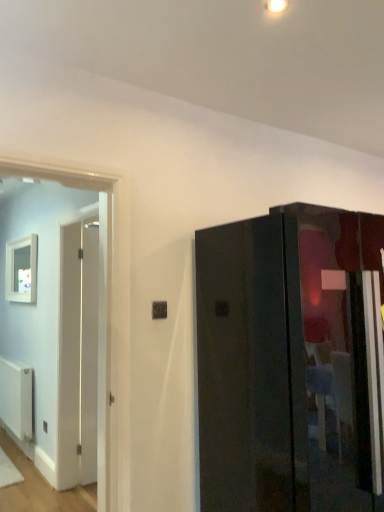
Find the location of a particular element. white matte picture frame at left is located at coordinates (21, 270).

I want to click on black plastic electric outlet at center, so click(x=159, y=310).

Describe the element at coordinates (291, 362) in the screenshot. I see `glossy black cabinet at right` at that location.

Locate an element on the screen. white matte picture frame at left is located at coordinates (21, 270).

From a real-world perspective, which is physically above, glossy black cabinet at right or white matte picture frame at left?

white matte picture frame at left.

Is white matte picture frame at left surrounded by glossy black cabinet at right?

That's incorrect, white matte picture frame at left is not inside glossy black cabinet at right.

Considering the relative sizes of glossy black cabinet at right and white matte picture frame at left in the image provided, is glossy black cabinet at right thinner than white matte picture frame at left?

In fact, glossy black cabinet at right might be wider than white matte picture frame at left.

Are glossy black cabinet at right and white matte picture frame at left beside each other?

No, glossy black cabinet at right is not making contact with white matte picture frame at left.

Are black plastic electric outlet at center and white matte radiator at lower left far apart?

Yes, black plastic electric outlet at center is far from white matte radiator at lower left.

Is point (160, 318) closer or farther from the camera than point (21, 369)?

Clearly, point (160, 318) is closer to the camera than point (21, 369).

Considering the sizes of objects black plastic electric outlet at center and white matte radiator at lower left in the image provided, who is smaller, black plastic electric outlet at center or white matte radiator at lower left?

Smaller between the two is black plastic electric outlet at center.

Can we say black plastic electric outlet at center lies outside white matte radiator at lower left?

Yes.

From the image's perspective, between glossy black cabinet at right and black plastic electric outlet at center, which one is located above?

From the image's view, black plastic electric outlet at center is above.

Can you tell me how much glossy black cabinet at right and black plastic electric outlet at center differ in facing direction?

0.858 degrees separate the facing orientations of glossy black cabinet at right and black plastic electric outlet at center.

Are glossy black cabinet at right and black plastic electric outlet at center making contact?

No, glossy black cabinet at right is not with black plastic electric outlet at center.

This screenshot has width=384, height=512. I want to click on door in front of the black plastic electric outlet at center, so [x=291, y=362].

Considering the positions of objects black plastic electric outlet at center and white matte picture frame at left in the image provided, who is more to the left, black plastic electric outlet at center or white matte picture frame at left?

white matte picture frame at left.

Where is `picture frame above the black plastic electric outlet at center (from the image's perspective)`? The width and height of the screenshot is (384, 512). picture frame above the black plastic electric outlet at center (from the image's perspective) is located at coordinates point(21,270).

From a real-world perspective, relative to white matte picture frame at left, is black plastic electric outlet at center vertically above or below?

Clearly, from a real-world perspective, black plastic electric outlet at center is below white matte picture frame at left.

Could white matte picture frame at left be considered to be inside black plastic electric outlet at center?

Actually, white matte picture frame at left is outside black plastic electric outlet at center.

Is white matte picture frame at left turned away from glossy black cabinet at right?

white matte picture frame at left is not turned away from glossy black cabinet at right.

Is white matte picture frame at left to the right of glossy black cabinet at right from the viewer's perspective?

No.

From the image's perspective, is white matte picture frame at left located above or below glossy black cabinet at right?

white matte picture frame at left is situated higher than glossy black cabinet at right in the image.

From a real-world perspective, who is located higher, glossy black cabinet at right or white matte radiator at lower left?

glossy black cabinet at right is physically above.

Considering the sizes of glossy black cabinet at right and white matte radiator at lower left in the image, is glossy black cabinet at right taller or shorter than white matte radiator at lower left?

glossy black cabinet at right is taller than white matte radiator at lower left.

Which is in front, point (287, 438) or point (18, 382)?

Positioned in front is point (287, 438).

Based on their positions, is glossy black cabinet at right located to the left or right of white matte radiator at lower left?

In the image, glossy black cabinet at right appears on the right side of white matte radiator at lower left.

Based on the photo, is white matte radiator at lower left thinner than white matte picture frame at left?

In fact, white matte radiator at lower left might be wider than white matte picture frame at left.

Is point (9, 408) less distant than point (24, 294)?

Yes, it is in front of point (24, 294).

Is white matte radiator at lower left facing away from white matte picture frame at left?

No.

Between white matte radiator at lower left and white matte picture frame at left, which one appears on the left side from the viewer's perspective?

white matte radiator at lower left.

The image size is (384, 512). I want to click on door located on the right of white matte picture frame at left, so click(x=291, y=362).

This screenshot has height=512, width=384. Find the location of `radiator to the left of black plastic electric outlet at center`. radiator to the left of black plastic electric outlet at center is located at coordinates (16, 397).

Considering their positions, is glossy black cabinet at right positioned closer to black plastic electric outlet at center than white matte radiator at lower left?

The object closer to black plastic electric outlet at center is glossy black cabinet at right.

Estimate the real-world distances between objects in this image. Which object is closer to black plastic electric outlet at center, white matte radiator at lower left or glossy black cabinet at right?

Based on the image, glossy black cabinet at right appears to be nearer to black plastic electric outlet at center.

From the picture: Looking at the image, which one is located further to white matte picture frame at left, black plastic electric outlet at center or white matte radiator at lower left?

black plastic electric outlet at center is further to white matte picture frame at left.

Considering their positions, is glossy black cabinet at right positioned closer to black plastic electric outlet at center than white matte picture frame at left?

glossy black cabinet at right is positioned closer to the anchor black plastic electric outlet at center.

Which object lies nearer to the anchor point white matte picture frame at left, glossy black cabinet at right or white matte radiator at lower left?

white matte radiator at lower left.

Estimate the real-world distances between objects in this image. Which object is closer to glossy black cabinet at right, white matte radiator at lower left or black plastic electric outlet at center?

Based on the image, black plastic electric outlet at center appears to be nearer to glossy black cabinet at right.

Considering their positions, is white matte radiator at lower left positioned further to white matte picture frame at left than glossy black cabinet at right?

The object further to white matte picture frame at left is glossy black cabinet at right.

Looking at the image, which one is located further to white matte picture frame at left, white matte radiator at lower left or black plastic electric outlet at center?

black plastic electric outlet at center lies further to white matte picture frame at left than the other object.

Identify the location of electric outlet between glossy black cabinet at right and white matte picture frame at left from front to back. The image size is (384, 512). (159, 310).

Identify the location of electric outlet situated between white matte radiator at lower left and glossy black cabinet at right from left to right. (159, 310).

At what (x,y) coordinates should I click in order to perform the action: click on picture frame situated between white matte radiator at lower left and glossy black cabinet at right from left to right. Please return your answer as a coordinate pair (x, y). The height and width of the screenshot is (512, 384). Looking at the image, I should click on (21, 270).

The image size is (384, 512). I want to click on radiator located between black plastic electric outlet at center and white matte picture frame at left in the depth direction, so click(16, 397).